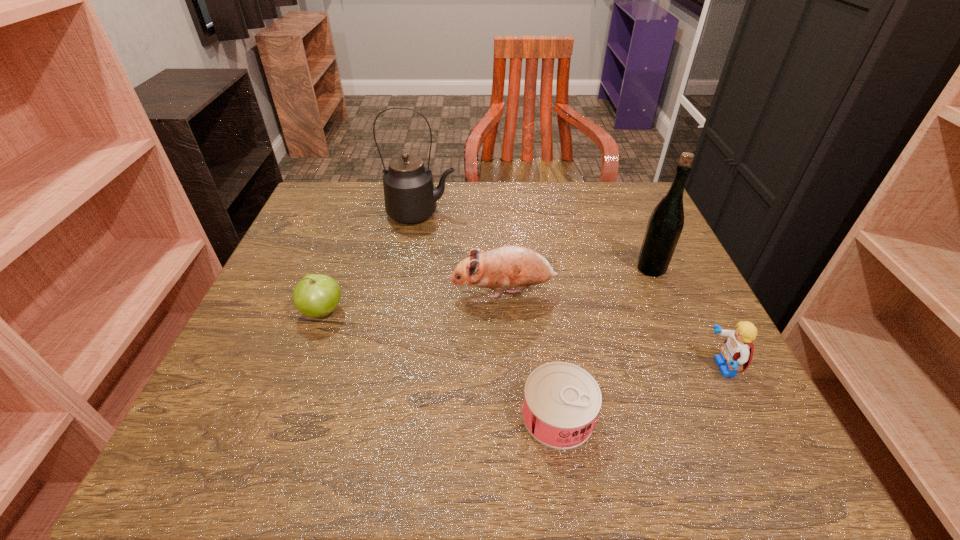
I want to click on beer bottle located at the right edge, so click(666, 221).

Locate an element on the screen. Lego positioned at the right edge is located at coordinates (738, 349).

In the image, there is a desktop. At what (x,y) coordinates should I click in order to perform the action: click on vacant region at the far edge. Please return your answer as a coordinate pair (x, y). Image resolution: width=960 pixels, height=540 pixels. Looking at the image, I should click on (544, 184).

Identify the location of vacant space at the near edge of the desktop. The height and width of the screenshot is (540, 960). (611, 466).

The image size is (960, 540). I want to click on vacant area at the left edge of the desktop, so click(348, 261).

I want to click on free point at the right edge, so click(681, 401).

Locate an element on the screen. The height and width of the screenshot is (540, 960). blank space at the far left corner of the desktop is located at coordinates (320, 191).

Where is `free space at the far right corner of the desktop`? Image resolution: width=960 pixels, height=540 pixels. free space at the far right corner of the desktop is located at coordinates (620, 188).

This screenshot has height=540, width=960. What are the coordinates of `vacant area at the near right corner` in the screenshot? It's located at (682, 465).

Locate an element on the screen. The width and height of the screenshot is (960, 540). vacant area that lies between the Lego and the can is located at coordinates (640, 392).